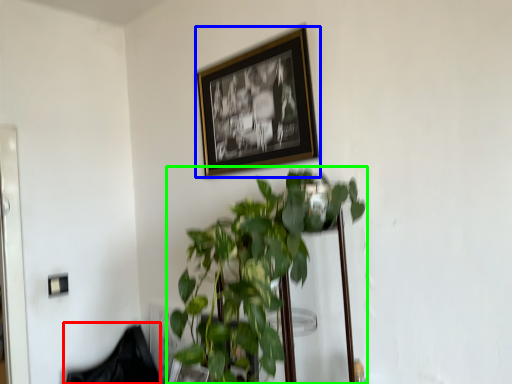
Question: Which object is the closest to the swivel chair (highlighted by a red box)? Choose among these: picture frame (highlighted by a blue box) or houseplant (highlighted by a green box).

Choices:
 (A) picture frame
 (B) houseplant

Answer: (B)